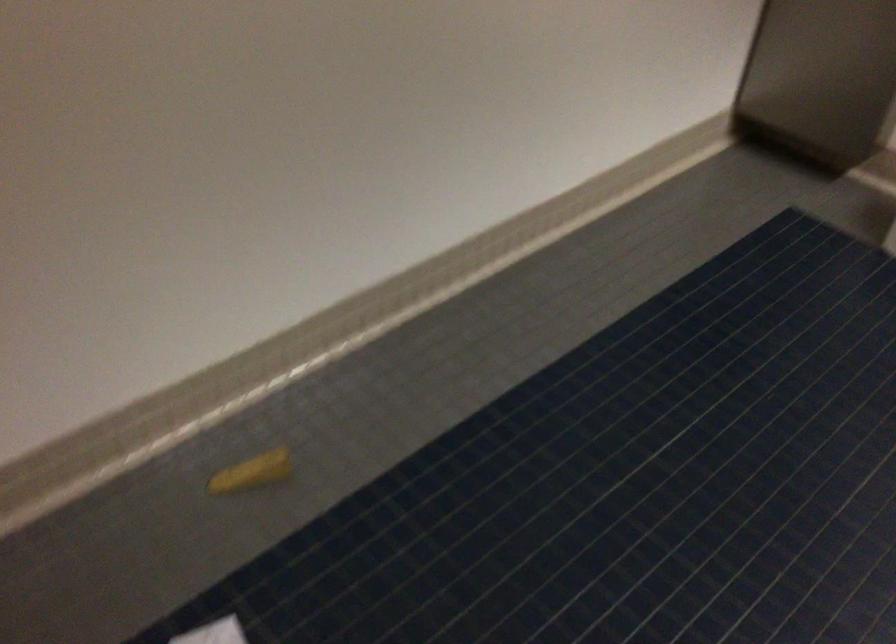
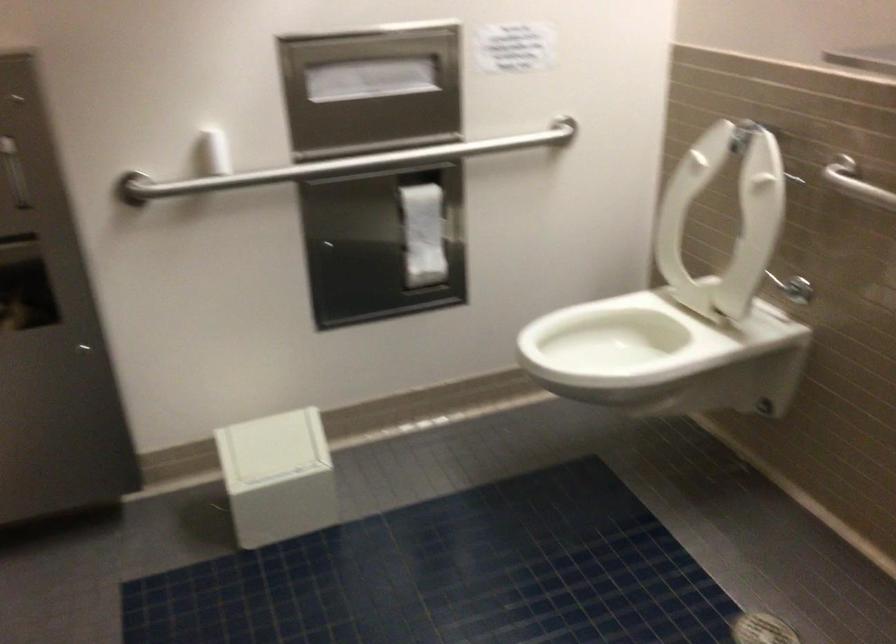
Question: Based on the continuous images, in which direction is the camera rotating? Reply with the corresponding letter.

Choices:
 (A) Left
 (B) Right
 (C) Up
 (D) Down

Answer: (B)